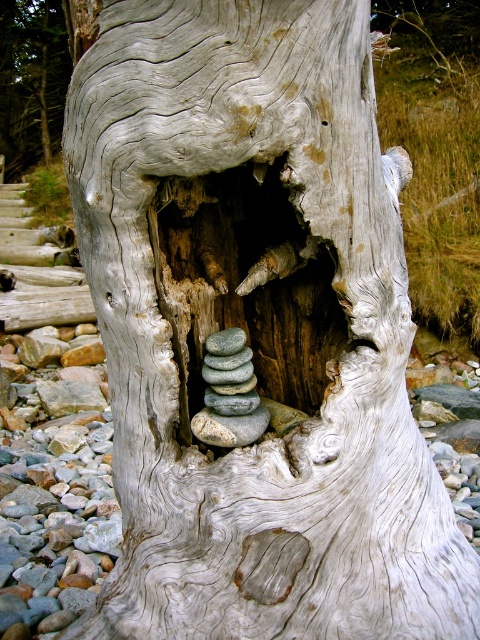
You are standing in front of the weathered tree trunk and want to place a small decorative item exactly at the point labeled as point (243,301). Based on the scene description, where would this point be located?

The point (243,301) corresponds to the gray wood hole at center, so placing the item there would position it inside the natural cavity of the tree trunk.

You are an artist planning to carve a sculpture from the gray wood hole at center and the smooth gray bark at center. Which part of the tree would be more suitable for creating a detailed, intricate design that requires a wider surface area?

The smooth gray bark at center has a wider width than the gray wood hole at center, making it more suitable for creating a detailed, intricate design that requires a wider surface area.

You are standing in front of the weathered tree trunk and want to place a small flag at one of the two points marked in the image. Which point, point (x=239, y=332) or point (x=3, y=40), is closer to you where you can easily reach it?

Point (x=239, y=332) is closer to the camera than point (x=3, y=40), so you can easily reach it.